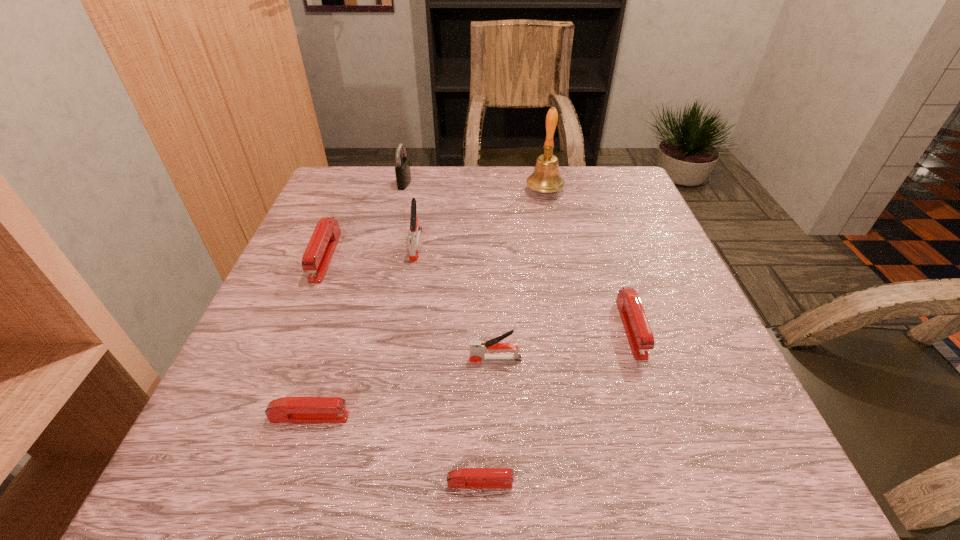
At what (x,y) coordinates should I click in order to perform the action: click on free space at the near edge. Please return your answer as a coordinate pair (x, y). The width and height of the screenshot is (960, 540). Looking at the image, I should click on (423, 441).

Image resolution: width=960 pixels, height=540 pixels. I want to click on blank area at the left edge, so click(x=298, y=369).

Identify the location of vacant region at the right edge of the desktop. The width and height of the screenshot is (960, 540). (590, 222).

In the image, there is a desktop. Identify the location of vacant space at the far left corner. (331, 191).

The height and width of the screenshot is (540, 960). In the image, there is a desktop. In order to click on vacant space at the near left corner in this screenshot , I will do `click(270, 468)`.

The width and height of the screenshot is (960, 540). Find the location of `blank space at the far right corner`. blank space at the far right corner is located at coordinates (585, 199).

You are a GUI agent. You are given a task and a screenshot of the screen. Output one action in this format:
    pyautogui.click(x=<x>, y=<y>)
    Task: Click on the vacant area between the right gray stapler and the third shortest stapler
    
    Given the screenshot: What is the action you would take?
    click(564, 343)

You are a GUI agent. You are given a task and a screenshot of the screen. Output one action in this format:
    pyautogui.click(x=<x>, y=<y>)
    Task: Click on the vacant area that lies between the seventh tallest object and the smallest red stapler
    This screenshot has width=960, height=540.
    Given the screenshot: What is the action you would take?
    pyautogui.click(x=395, y=450)

This screenshot has width=960, height=540. In order to click on vacant space that's between the leftmost red stapler and the tallest object in this screenshot , I will do coord(435,224).

In order to click on free space between the nearer gray stapler and the black padlock in this screenshot , I will do `click(450, 271)`.